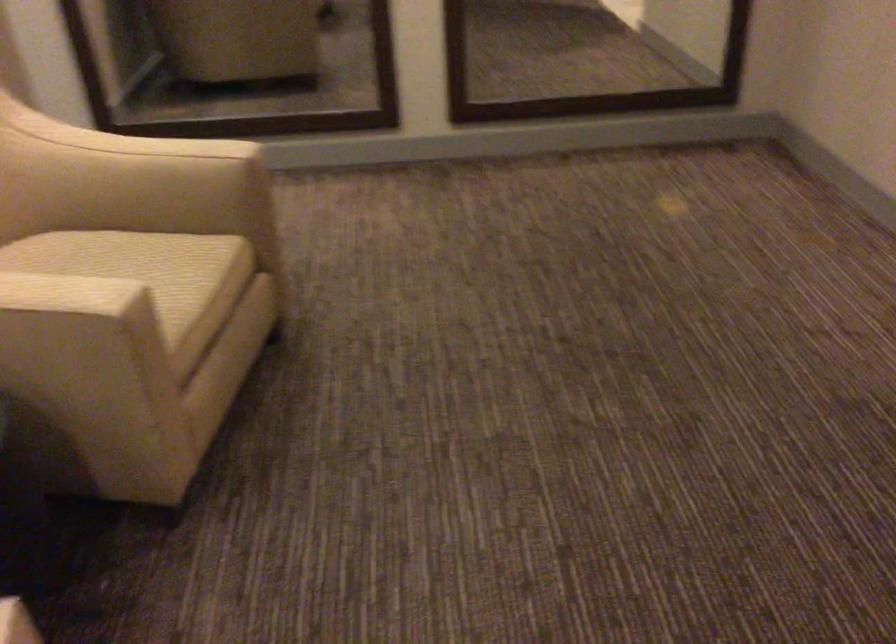
Image resolution: width=896 pixels, height=644 pixels. Identify the location of chair armrest. (x=116, y=136).